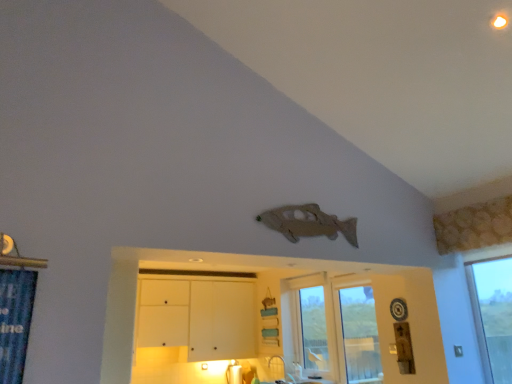
Question: Is white matte cabinet at lower center, which is counted as the 1th dresser, starting from the back, further to the viewer compared to wooden fish at upper center, marked as the second dresser in a back-to-front arrangement?

Choices:
 (A) yes
 (B) no

Answer: (A)

Question: Is white matte cabinet at lower center, which is counted as the 1th dresser, starting from the back, positioned in front of wooden fish at upper center, which is the first dresser from front to back?

Choices:
 (A) no
 (B) yes

Answer: (A)

Question: From a real-world perspective, is white matte cabinet at lower center, positioned as the 2th dresser in front-to-back order, on wooden fish at upper center, which is the first dresser from front to back?

Choices:
 (A) yes
 (B) no

Answer: (A)

Question: From the image's perspective, would you say white matte cabinet at lower center, positioned as the 2th dresser in front-to-back order, is shown under wooden fish at upper center, which is the first dresser from front to back?

Choices:
 (A) yes
 (B) no

Answer: (A)

Question: Is white matte cabinet at lower center, positioned as the 2th dresser in front-to-back order, turned away from wooden fish at upper center, marked as the second dresser in a back-to-front arrangement?

Choices:
 (A) yes
 (B) no

Answer: (A)

Question: Is matte gray fish at upper center bigger or smaller than white matte cabinet at lower center, positioned as the 2th dresser in front-to-back order?

Choices:
 (A) small
 (B) big

Answer: (A)

Question: From a real-world perspective, is matte gray fish at upper center above or below white matte cabinet at lower center, which is counted as the 1th dresser, starting from the back?

Choices:
 (A) above
 (B) below

Answer: (A)

Question: Visually, is matte gray fish at upper center positioned to the left or to the right of white matte cabinet at lower center, which is counted as the 1th dresser, starting from the back?

Choices:
 (A) left
 (B) right

Answer: (B)

Question: Considering the positions of matte gray fish at upper center and white matte cabinet at lower center, which is counted as the 1th dresser, starting from the back, in the image, is matte gray fish at upper center wider or thinner than white matte cabinet at lower center, which is counted as the 1th dresser, starting from the back,?

Choices:
 (A) wide
 (B) thin

Answer: (B)

Question: Considering the positions of wooden fish at upper center, marked as the second dresser in a back-to-front arrangement, and transparent glass door at center, the 2th window from the back, in the image, is wooden fish at upper center, marked as the second dresser in a back-to-front arrangement, taller or shorter than transparent glass door at center, the 2th window from the back,?

Choices:
 (A) tall
 (B) short

Answer: (B)

Question: From a real-world perspective, relative to transparent glass door at center, the 2th window from the back, is wooden fish at upper center, which is the first dresser from front to back, vertically above or below?

Choices:
 (A) above
 (B) below

Answer: (A)

Question: Is point (422, 317) closer or farther from the camera than point (366, 312)?

Choices:
 (A) closer
 (B) farther

Answer: (A)

Question: In the image, is wooden fish at upper center, marked as the second dresser in a back-to-front arrangement, on the left side or the right side of transparent glass door at center, which is the first window in front-to-back order?

Choices:
 (A) left
 (B) right

Answer: (A)

Question: In the image, is blue fabric shower curtain at left positioned in front of or behind matte gray fish at upper center?

Choices:
 (A) behind
 (B) front

Answer: (B)

Question: From the image's perspective, is blue fabric shower curtain at left above or below matte gray fish at upper center?

Choices:
 (A) above
 (B) below

Answer: (B)